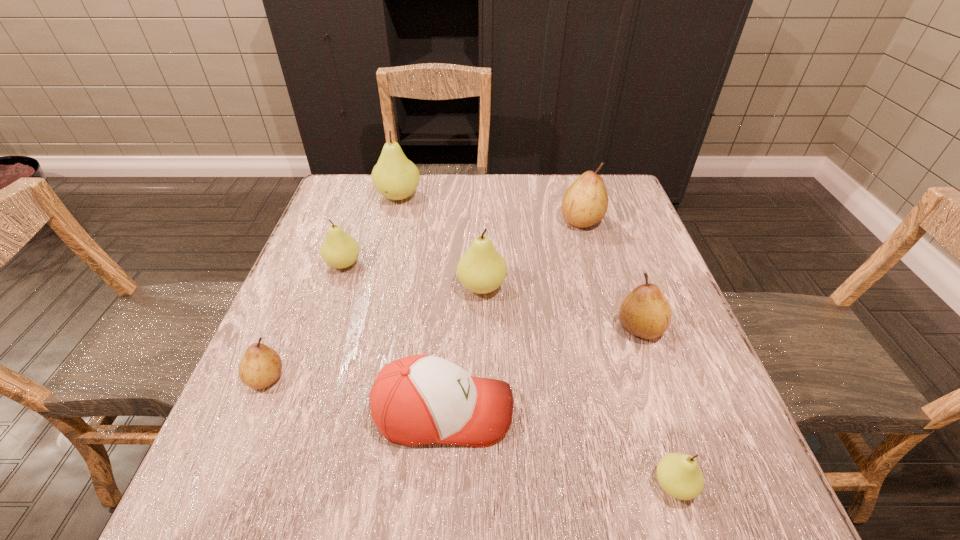
You are a GUI agent. You are given a task and a screenshot of the screen. Output one action in this format:
    pyautogui.click(x=<x>, y=<y>)
    Task: Click on the object identified as the seventh closest to the second smallest green pear
    The width and height of the screenshot is (960, 540).
    Given the screenshot: What is the action you would take?
    pyautogui.click(x=680, y=476)

Locate which object ranks seventh in proximity to the smallest brown pear. Please provide its 2D coordinates. Your answer should be formatted as a tuple, i.e. [(x, y)], where the tuple contains the x and y coordinates of a point satisfying the conditions above.

[(585, 203)]

I want to click on the third closest pear to the second smallest green pear, so click(261, 366).

Locate an element on the screen. This screenshot has height=540, width=960. the second closest pear relative to the leftmost brown pear is located at coordinates (482, 269).

Identify which green pear is the closest to the tallest pear. Please provide its 2D coordinates. Your answer should be formatted as a tuple, i.e. [(x, y)], where the tuple contains the x and y coordinates of a point satisfying the conditions above.

[(339, 250)]

The width and height of the screenshot is (960, 540). In order to click on the third closest green pear to the orange baseball cap in this screenshot , I will do `click(339, 250)`.

Find the location of a particular element. brown pear identified as the third closest to the nearest green pear is located at coordinates (261, 366).

Find the location of `brown pear object that ranks as the closest to the fifth farthest pear`. brown pear object that ranks as the closest to the fifth farthest pear is located at coordinates (585, 203).

This screenshot has height=540, width=960. Find the location of `free space that satisfies the following two spatial constraints: 1. on the front side of the smallest green pear; 2. on the left side of the second green pear from right to left`. free space that satisfies the following two spatial constraints: 1. on the front side of the smallest green pear; 2. on the left side of the second green pear from right to left is located at coordinates (483, 485).

I want to click on free spot that satisfies the following two spatial constraints: 1. on the front-facing side of the smallest green pear; 2. on the right side of the baseball cap, so click(x=439, y=485).